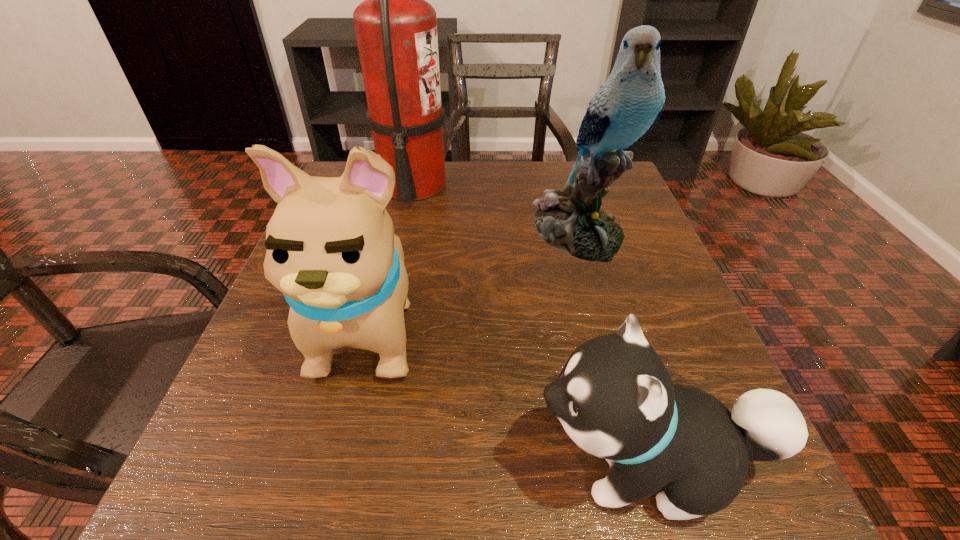
The image size is (960, 540). I want to click on vacant space located 0.180m at the face of the nearest object, so click(x=388, y=464).

Locate an element on the screen. Image resolution: width=960 pixels, height=540 pixels. free space located 0.100m at the face of the nearest object is located at coordinates (452, 464).

Find the location of a particular element. This screenshot has width=960, height=540. fire extinguisher that is positioned at the far edge is located at coordinates (396, 29).

This screenshot has width=960, height=540. I want to click on parakeet located in the far edge section of the desktop, so click(x=627, y=106).

This screenshot has height=540, width=960. What are the coordinates of `object positioned at the near edge` in the screenshot? It's located at (614, 397).

Find the location of a particular element. fire extinguisher present at the left edge is located at coordinates (396, 29).

The width and height of the screenshot is (960, 540). Find the location of `puppy that is positioned at the left edge`. puppy that is positioned at the left edge is located at coordinates (331, 249).

Where is `parakeet located in the right edge section of the desktop`? parakeet located in the right edge section of the desktop is located at coordinates (627, 106).

At what (x,y) coordinates should I click in order to perform the action: click on puppy positioned at the right edge. Please return your answer as a coordinate pair (x, y). Looking at the image, I should click on (614, 397).

Where is `object present at the far left corner`? The width and height of the screenshot is (960, 540). object present at the far left corner is located at coordinates (396, 29).